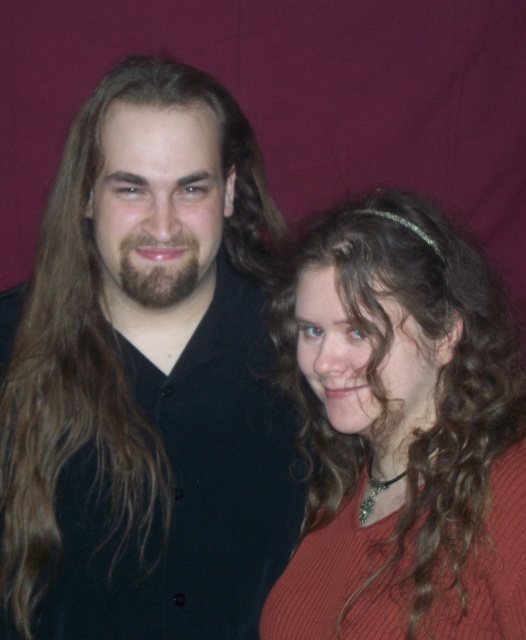
You are a photographer setting up a portrait shoot with two models. You have a camera with a lens that has a minimum focusing distance of 8 inches. The models are currently positioned as shown in the image. Can you take a clear photo of both the matte black shirt at left and the matte red sweater at right without moving them?

The matte black shirt at left and matte red sweater at right are 7.45 inches apart, which is less than the camera lens minimum focusing distance of 8 inches. Therefore, you can take a clear photo of both the matte black shirt at left and the matte red sweater at right without moving them.

You are a photographer adjusting the lighting for a portrait. You need to place a spotlight at point (145, 381). According to the scene description, what object will the spotlight illuminate?

The spotlight at point (145, 381) will illuminate the matte black shirt at left.